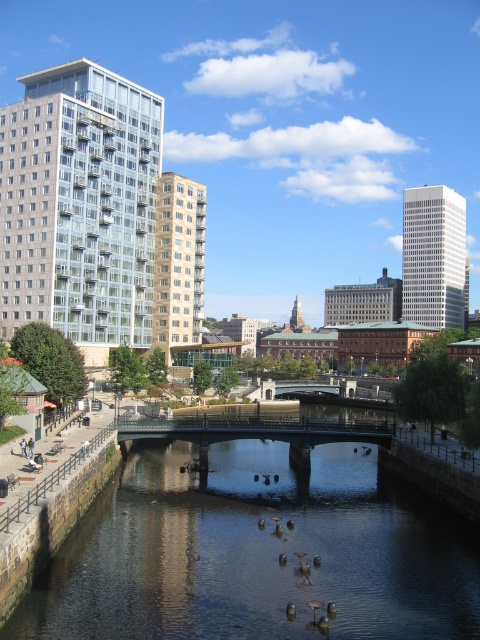
The image size is (480, 640). Describe the element at coordinates (256, 554) in the screenshot. I see `dark reflective water at center` at that location.

Can you confirm if dark reflective water at center is positioned above metallic gray bridge at center?

Incorrect, dark reflective water at center is not positioned above metallic gray bridge at center.

Who is more forward, [349,541] or [261,436]?

Point [349,541] is in front.

Identify the location of dark reflective water at center. This screenshot has height=640, width=480. (256, 554).